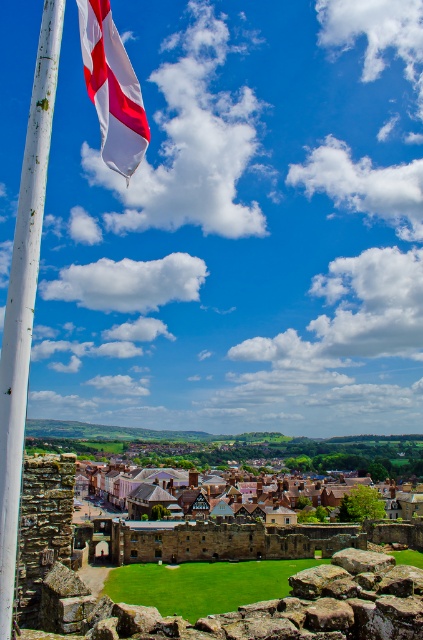
Question: Where is white matte flag at upper left located in relation to brown wooden houses at center in the image?

Choices:
 (A) right
 (B) left

Answer: (B)

Question: Does white wood pole at left appear on the right side of brown wooden houses at center?

Choices:
 (A) yes
 (B) no

Answer: (B)

Question: Which point is farther to the camera?

Choices:
 (A) white matte flag at upper left
 (B) brown wooden houses at center
 (C) white wood pole at left

Answer: (B)

Question: Which object is farther from the camera taking this photo?

Choices:
 (A) white matte flag at upper left
 (B) white wood pole at left

Answer: (A)

Question: Which object is positioned farthest from the brown wooden houses at center?

Choices:
 (A) white matte flag at upper left
 (B) white wood pole at left

Answer: (A)

Question: Is white wood pole at left positioned at the back of white matte flag at upper left?

Choices:
 (A) no
 (B) yes

Answer: (A)